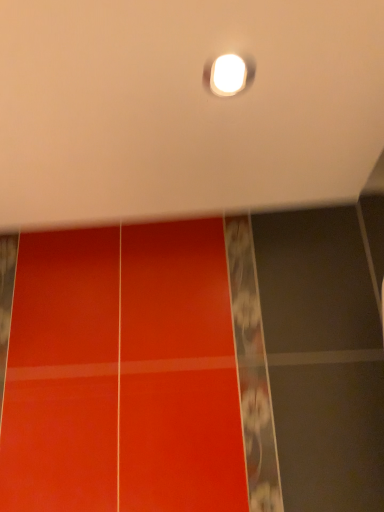
Locate an element on the screen. white glossy light at upper center is located at coordinates [x=228, y=75].

What do you see at coordinates (228, 75) in the screenshot?
I see `white glossy light at upper center` at bounding box center [228, 75].

Find the location of `white glossy light at upper center`. white glossy light at upper center is located at coordinates (228, 75).